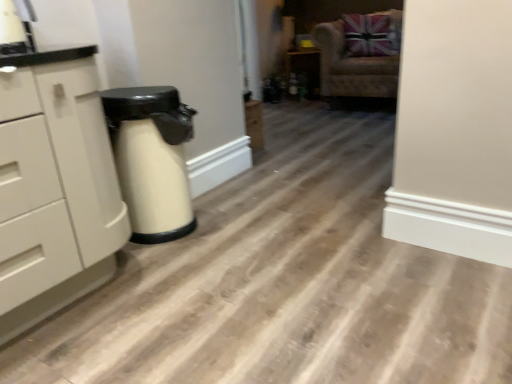
Where is `vacant area to the right of white matte chest of drawers at left`? The image size is (512, 384). vacant area to the right of white matte chest of drawers at left is located at coordinates (199, 281).